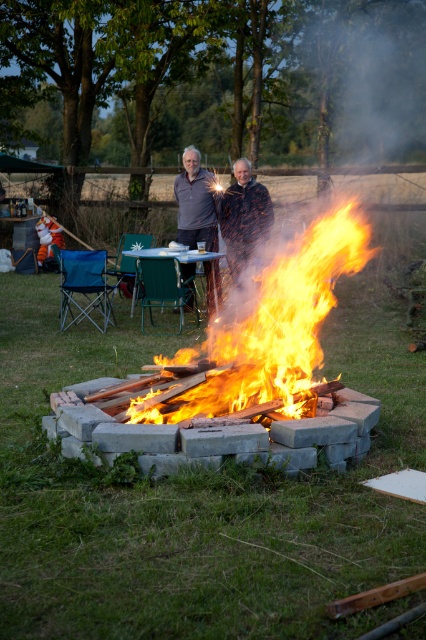
You are standing at the edge of the campfire and want to place a marshmallow stick. The small table with items is to your left. If you move straight towards the flaming wood at center, will you pass by the small table with items on the left?

The flaming wood at center is located at point (282, 317), so moving straight towards it from the edge of the campfire would not pass by the small table with items on the left since it is positioned to the left of the frame.

You are planning to place a new jacket on the table to the left of the frame. The table currently has the matte black jackets at center. Considering the size of the flaming wood at center, will the new jacket fit on the table without overlapping?

The flaming wood at center is larger than the matte black jackets at center. Since the flaming wood is bigger, the jackets are smaller. Therefore, the new jacket should fit on the table as long as it is similar in size to the existing jackets.